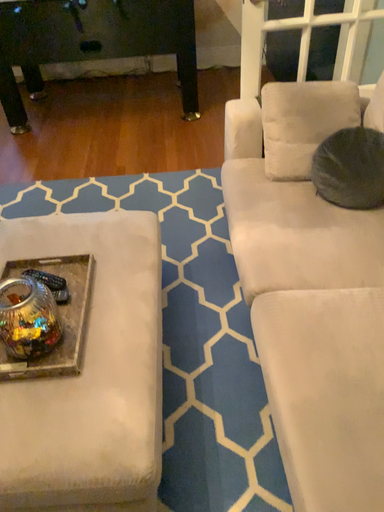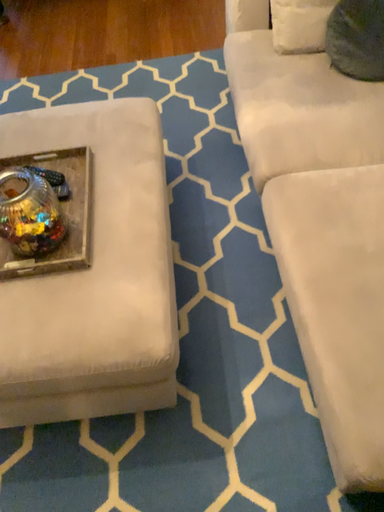
Question: How did the camera likely rotate when shooting the video?

Choices:
 (A) rotated upward
 (B) rotated downward

Answer: (B)